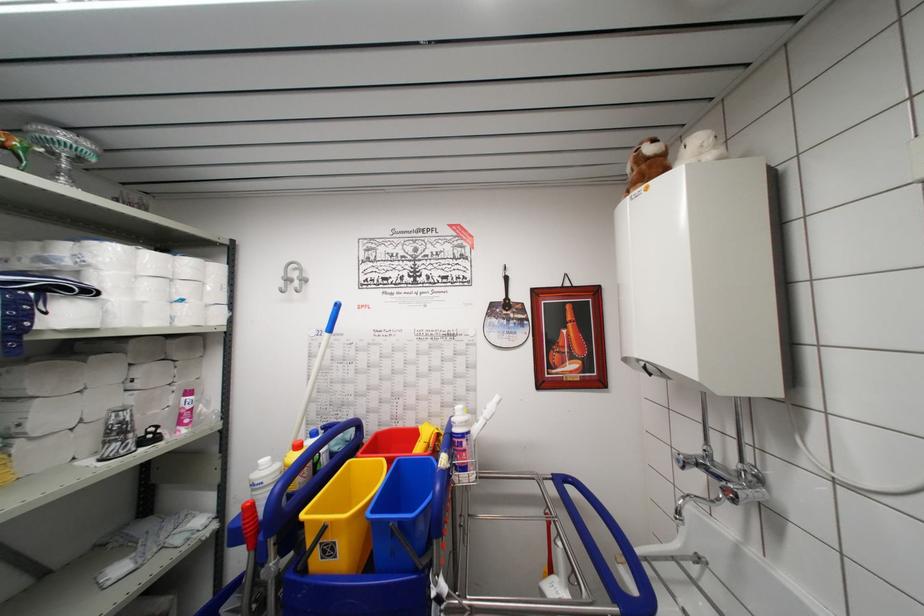
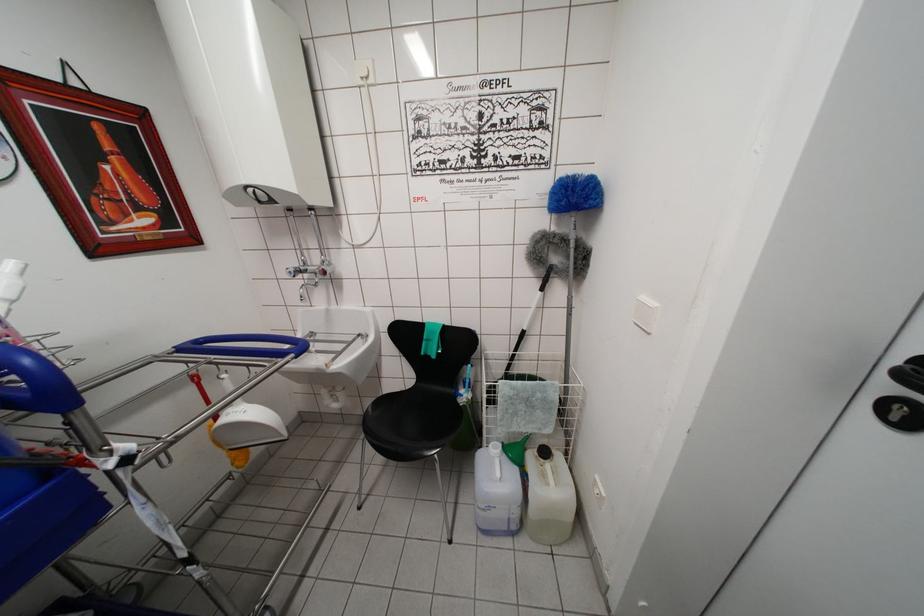
In the second image, find the point that corresponds to pixel 682 464 in the first image.

(293, 277)